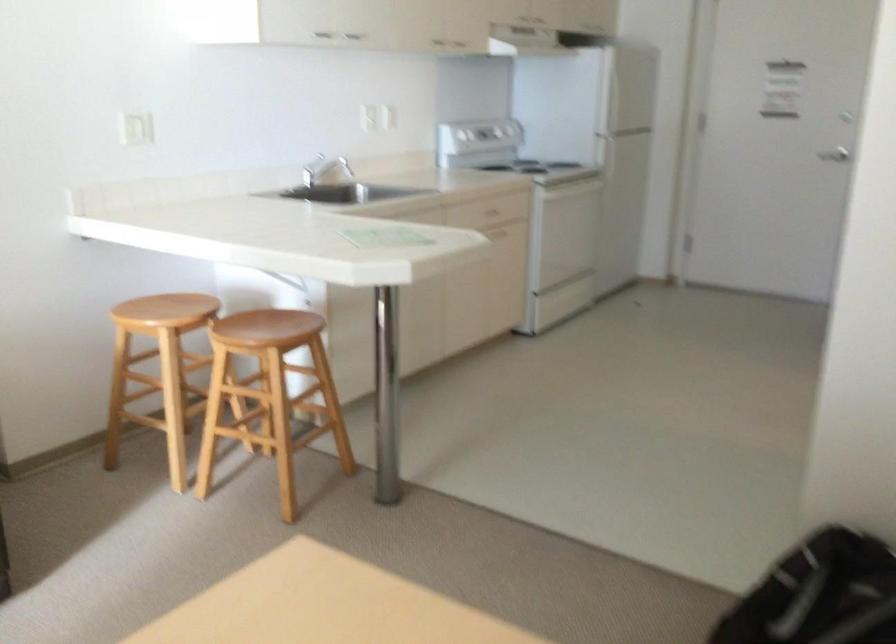
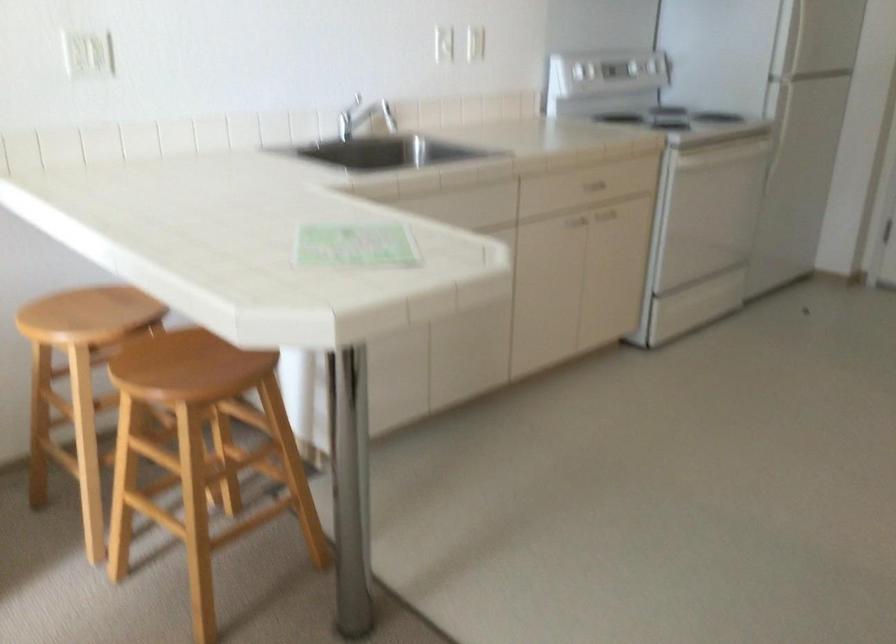
Find the pixel in the second image that matches [385,106] in the first image.

(471, 43)